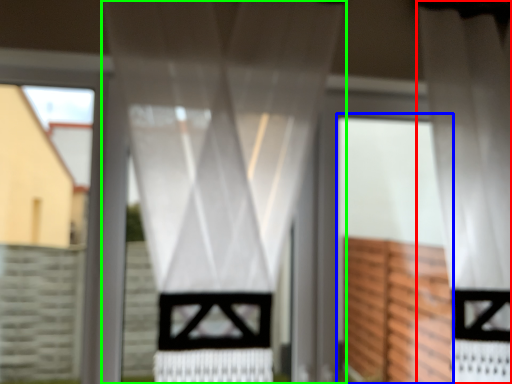
Question: Which object is the farthest from curtain (highlighted by a red box)? Choose among these: screen door (highlighted by a blue box) or curtain (highlighted by a green box).

Choices:
 (A) screen door
 (B) curtain

Answer: (B)